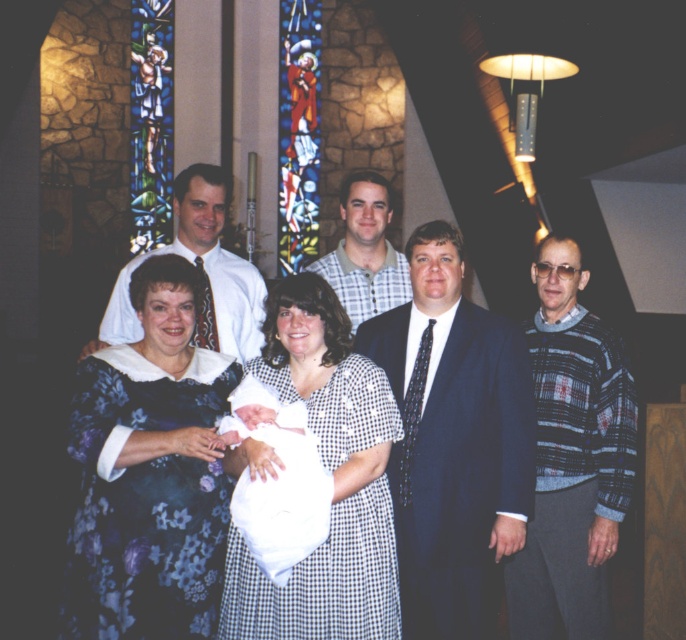
Question: Can you confirm if plaid sweater at right is positioned to the right of white cloth at center?

Choices:
 (A) yes
 (B) no

Answer: (A)

Question: Which of these objects is positioned closest to the dark blue suit at center?

Choices:
 (A) plaid sweater at right
 (B) floral dress at center
 (C) white checkered dress at center
 (D) floral-patterned dress at center

Answer: (B)

Question: Is floral dress at center further to camera compared to white cloth at center?

Choices:
 (A) no
 (B) yes

Answer: (B)

Question: Which of these objects is positioned farthest from the white checkered dress at center?

Choices:
 (A) white cloth at center
 (B) plaid sweater at right

Answer: (B)

Question: Which object is farther from the camera taking this photo?

Choices:
 (A) floral-patterned dress at center
 (B) plaid sweater at right
 (C) matte white shirt at upper left

Answer: (C)

Question: Is white cloth at center above checkered fabric shirt at center?

Choices:
 (A) no
 (B) yes

Answer: (A)